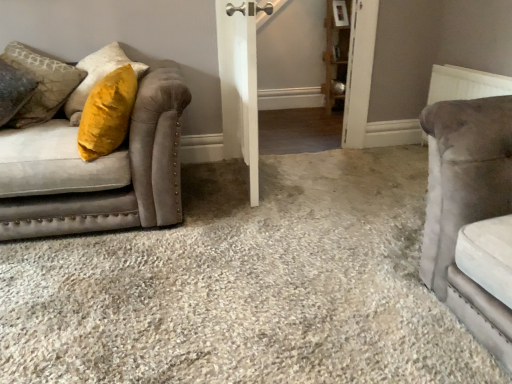
Question: Can you confirm if white textured radiator at upper right is taller than white wooden barn door at center?

Choices:
 (A) no
 (B) yes

Answer: (A)

Question: From a real-world perspective, is white textured radiator at upper right on white wooden barn door at center?

Choices:
 (A) no
 (B) yes

Answer: (A)

Question: From the image's perspective, is white textured radiator at upper right beneath white wooden barn door at center?

Choices:
 (A) no
 (B) yes

Answer: (B)

Question: Is white textured radiator at upper right bigger than white wooden barn door at center?

Choices:
 (A) no
 (B) yes

Answer: (A)

Question: Is white textured radiator at upper right to the right of white wooden barn door at center from the viewer's perspective?

Choices:
 (A) yes
 (B) no

Answer: (A)

Question: Visually, is velvet yellow pillow at left positioned to the left or to the right of white textured radiator at upper right?

Choices:
 (A) left
 (B) right

Answer: (A)

Question: Considering the positions of velvet yellow pillow at left and white textured radiator at upper right in the image, is velvet yellow pillow at left wider or thinner than white textured radiator at upper right?

Choices:
 (A) wide
 (B) thin

Answer: (A)

Question: Considering their positions, is velvet yellow pillow at left located in front of or behind white textured radiator at upper right?

Choices:
 (A) behind
 (B) front

Answer: (B)

Question: In terms of height, does velvet yellow pillow at left look taller or shorter compared to white textured radiator at upper right?

Choices:
 (A) short
 (B) tall

Answer: (B)

Question: Considering the positions of white wooden barn door at center and velvet yellow pillow at left in the image, is white wooden barn door at center bigger or smaller than velvet yellow pillow at left?

Choices:
 (A) big
 (B) small

Answer: (A)

Question: From the image's perspective, is white wooden barn door at center above or below velvet yellow pillow at left?

Choices:
 (A) below
 (B) above

Answer: (A)

Question: From a real-world perspective, is white wooden barn door at center positioned above or below velvet yellow pillow at left?

Choices:
 (A) above
 (B) below

Answer: (B)

Question: In terms of height, does white wooden barn door at center look taller or shorter compared to velvet yellow pillow at left?

Choices:
 (A) short
 (B) tall

Answer: (B)

Question: From the image's perspective, relative to wooden shelf at upper right, is white textured radiator at upper right above or below?

Choices:
 (A) above
 (B) below

Answer: (B)

Question: In the image, is white textured radiator at upper right positioned in front of or behind wooden shelf at upper right?

Choices:
 (A) front
 (B) behind

Answer: (A)